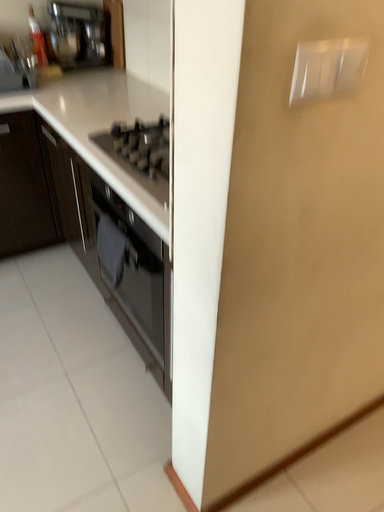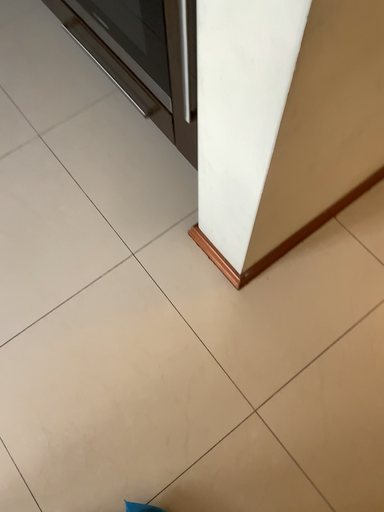
Question: How did the camera likely rotate when shooting the video?

Choices:
 (A) rotated upward
 (B) rotated downward

Answer: (B)